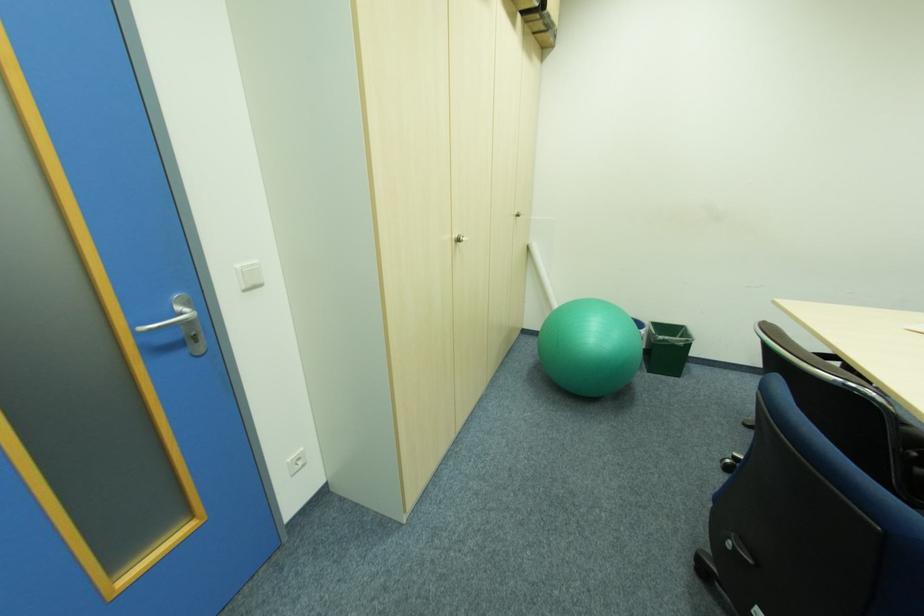
Find where to pull the silver door handle. Please return your answer as a coordinate pair (x, y).

(181, 323)